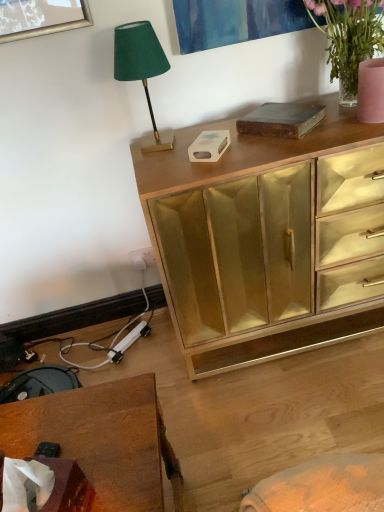
Locate an element on the screen. blank space situated above wooden desk at lower left (from a real-world perspective) is located at coordinates (80, 437).